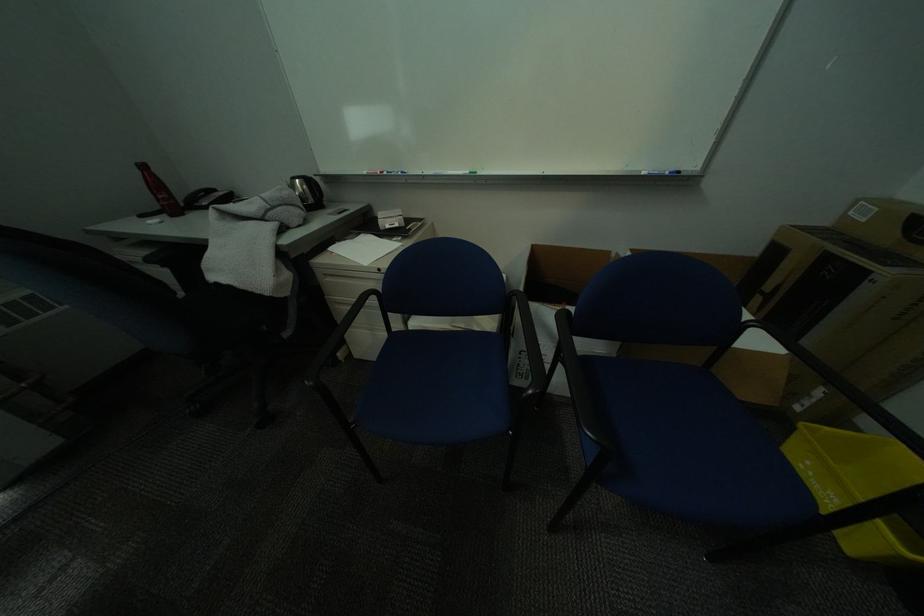
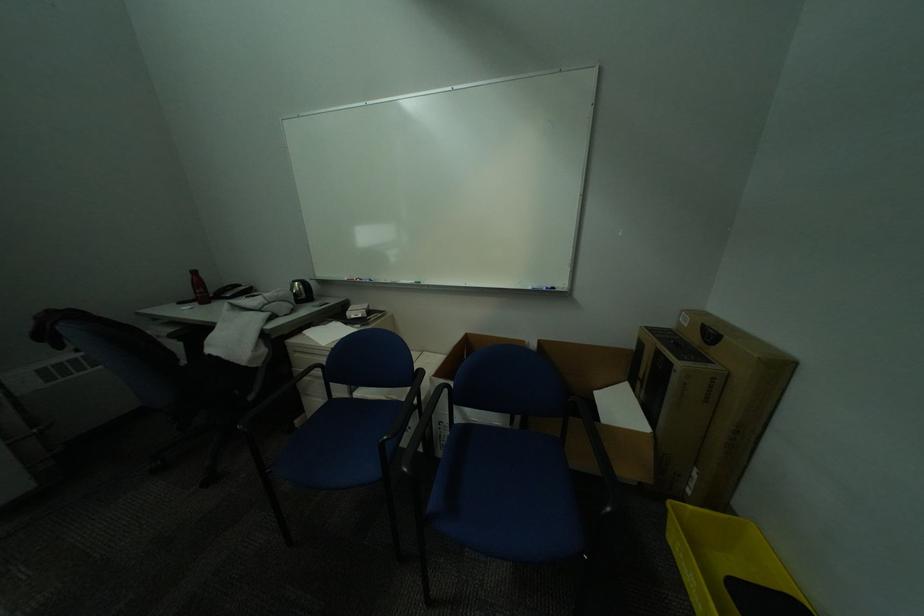
Find the pixel in the second image that matches [861,215] in the first image.

(691, 321)